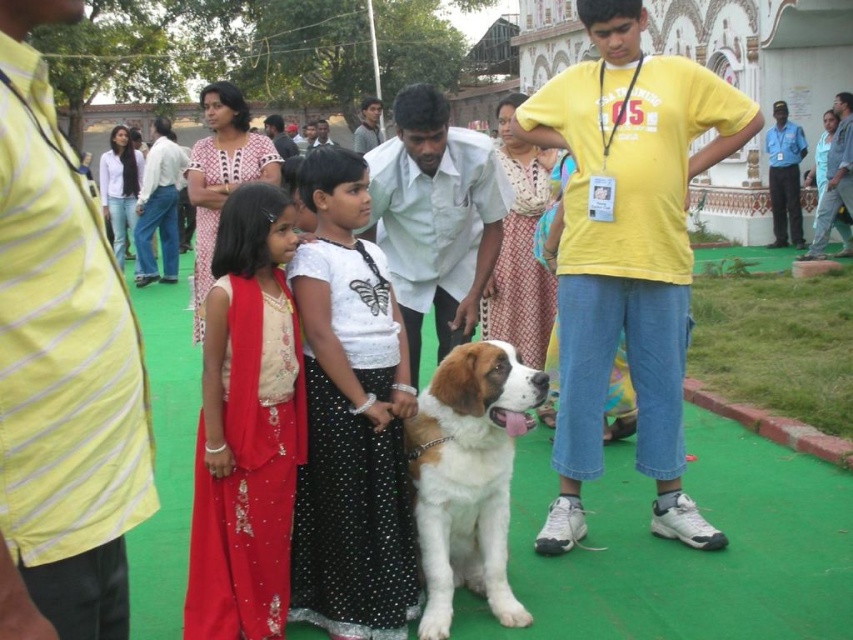
Between white dotted skirt at center and shiny red dress at center, which one has less height?

With less height is shiny red dress at center.

Does white dotted skirt at center appear over shiny red dress at center?

Correct, white dotted skirt at center is located above shiny red dress at center.

The width and height of the screenshot is (853, 640). What are the coordinates of `white dotted skirt at center` in the screenshot? It's located at (x=350, y=419).

Between shiny red dress at center and white fur with brown patches at center, which one has more height?

Standing taller between the two is shiny red dress at center.

Can you confirm if shiny red dress at center is positioned below white fur with brown patches at center?

No, shiny red dress at center is not below white fur with brown patches at center.

Which is in front, point (216, 253) or point (421, 477)?

Point (421, 477)

This screenshot has width=853, height=640. I want to click on shiny red dress at center, so click(247, 426).

Is white dotted skirt at center taller than white fur with brown patches at center?

Yes.

Who is more forward, (363, 444) or (525, 372)?

Positioned in front is point (525, 372).

Which is in front, point (380, 496) or point (440, 547)?

Positioned in front is point (440, 547).

Find the location of a particular element. white dotted skirt at center is located at coordinates (350, 419).